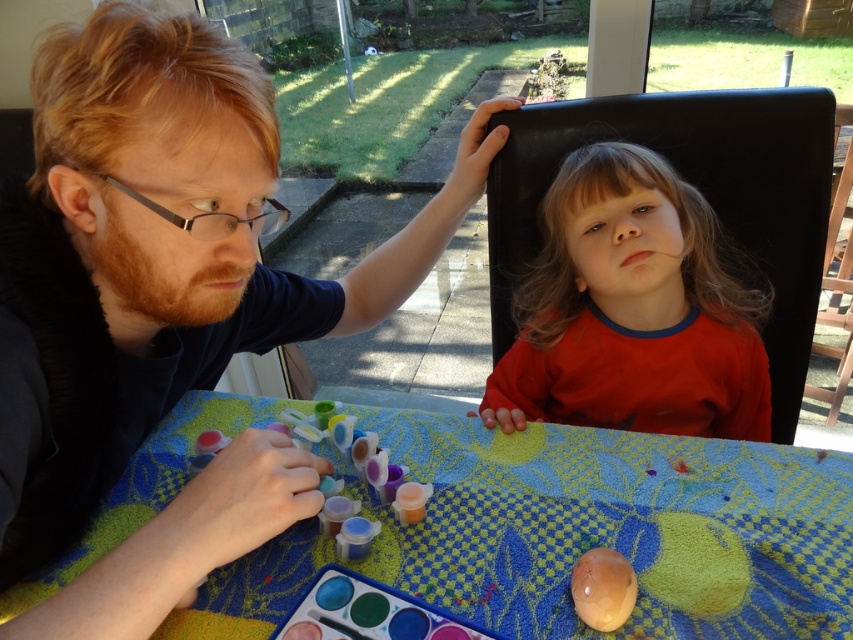
Based on the photo, you are a guest at a garden party and want to sit next to the person wearing the red matte shirt at upper center. Where should you sit relative to the matte plastic table at center?

You should sit to the right of the matte plastic table at center because the red matte shirt at upper center is located to the right of the matte plastic table at center.

Consider the image. You are a photographer setting up a shot of the red matte shirt at upper center and the matte brown egg at lower center. Which object should you focus on first if you want to capture both in one frame without moving the camera?

The red matte shirt at upper center is bigger than the matte brown egg at lower center, so you should focus on the red matte shirt at upper center first to ensure it is in clear view before adjusting for the smaller egg.

You are organizing a clothing donation drive and need to categorize shirts by size. You have two shirts to sort out. The first is a matte black shirt at upper left and the second is a red matte shirt at upper center. Which shirt should you place in the large size bin?

The matte black shirt at upper left should be placed in the large size bin because its width is larger than the red matte shirt at upper center.